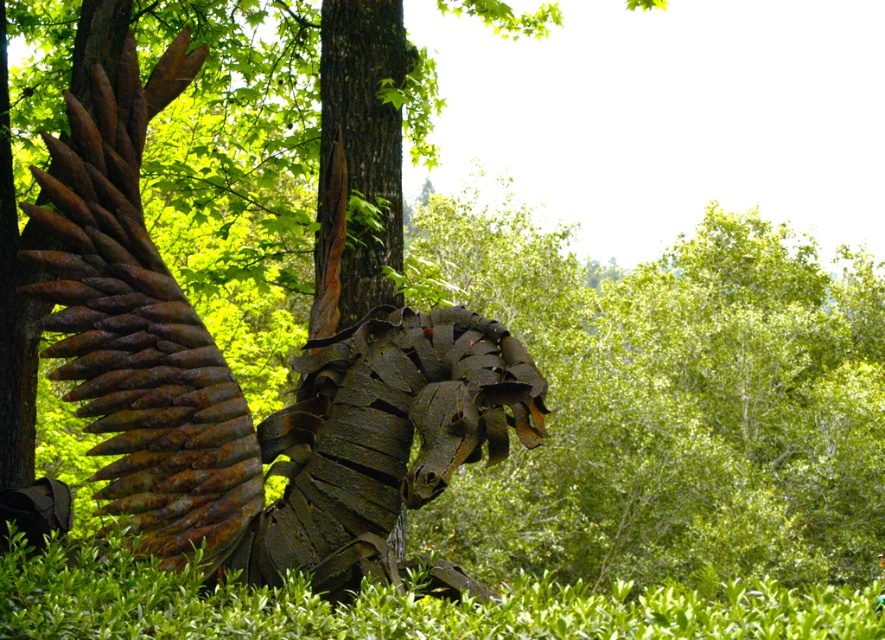
Is rusty metal sculpture at center to the right of green leafy hedge at lower center from the viewer's perspective?

In fact, rusty metal sculpture at center is to the left of green leafy hedge at lower center.

Does rusty metal sculpture at center have a larger size compared to green leafy hedge at lower center?

No.

This screenshot has height=640, width=885. Find the location of `rusty metal sculpture at center`. rusty metal sculpture at center is located at coordinates (237, 385).